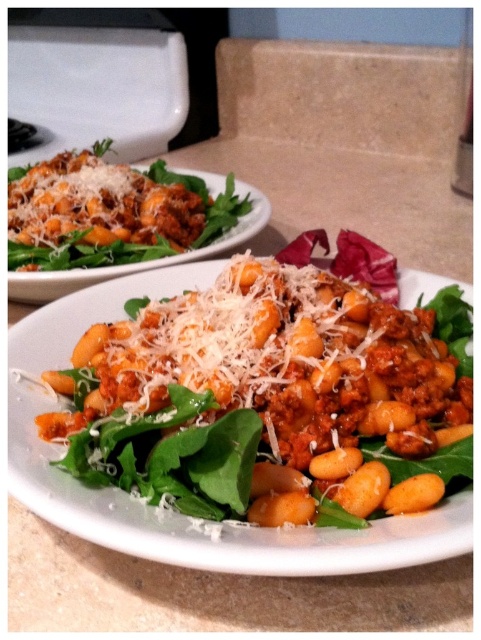
You are a food photographer holding a camera. You want to capture a closeup shot of the matte orange gnocchi at center. The camera requires the subject to be within 30 centimeters for optimal focus. Can you take the photo without moving the gnocchi or the camera?

The matte orange gnocchi at center and camera are 40.33 centimeters apart, which is beyond the 30 centimeter range required for optimal focus. Therefore, you cannot take the photo without moving the gnocchi or the camera.

You are a food critic evaluating two types of gnocchi on a plate. The first is the matte orange gnocchi at center and the second is the matte brown gnocchi at center. Which one is smaller in size?

The matte orange gnocchi at center has a smaller size compared to the matte brown gnocchi at center.

You are a food critic standing at the counter where both the matte orange gnocchi at center and the matte brown gnocchi at center are placed. Which gnocchi dish is closer to you?

The matte orange gnocchi at center is closer to you because it is in front of the matte brown gnocchi at center.